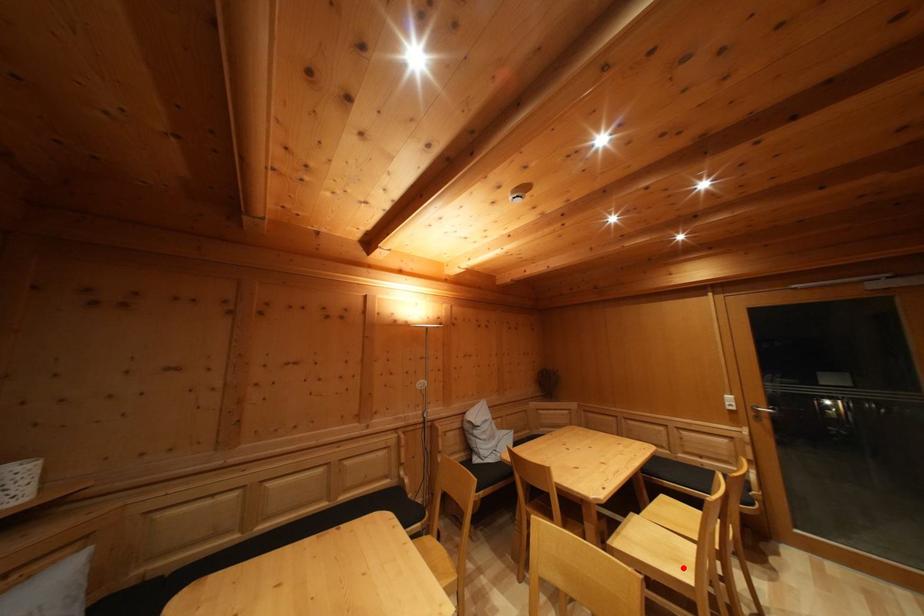
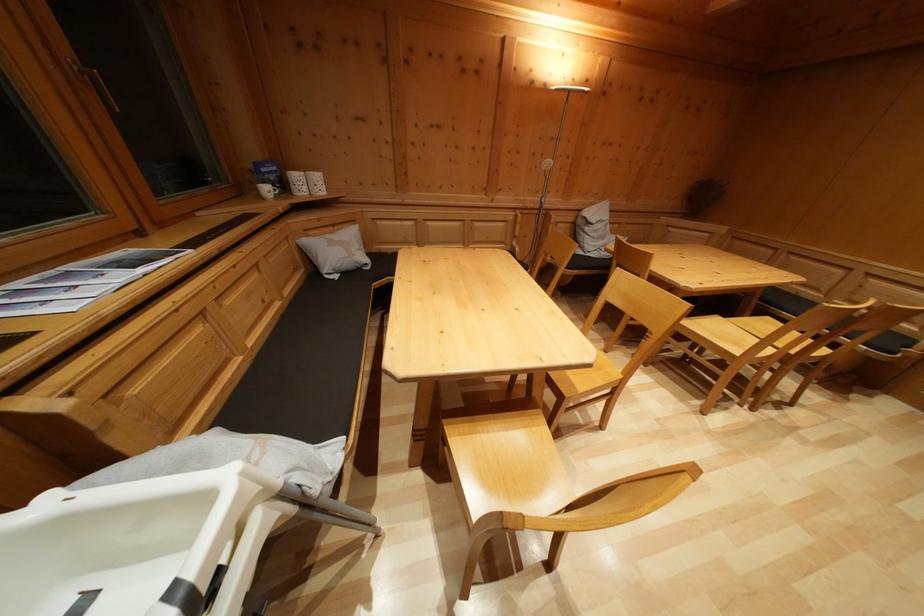
In the second image, find the point that corresponds to the highlighted location in the first image.

(743, 352)